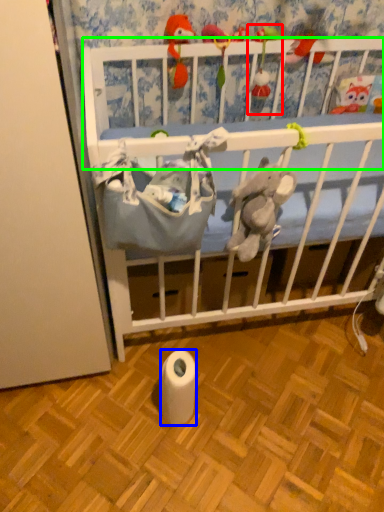
Question: Estimate the real-world distances between objects in this image. Which object is closer to toy (highlighted by a red box), toilet paper (highlighted by a blue box) or infant bed (highlighted by a green box)?

Choices:
 (A) toilet paper
 (B) infant bed

Answer: (B)